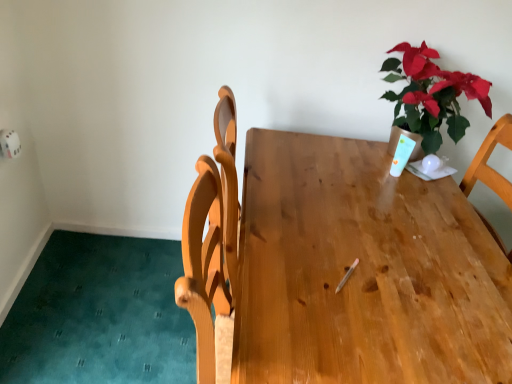
Question: Based on their sizes in the image, would you say wooden table at center is bigger or smaller than green leafy plant at upper right?

Choices:
 (A) big
 (B) small

Answer: (A)

Question: From a real-world perspective, is wooden table at center above or below green leafy plant at upper right?

Choices:
 (A) below
 (B) above

Answer: (A)

Question: Based on their positions, is wooden table at center located to the left or right of green leafy plant at upper right?

Choices:
 (A) right
 (B) left

Answer: (B)

Question: Is green leafy plant at upper right in front of or behind wooden table at center in the image?

Choices:
 (A) behind
 (B) front

Answer: (A)

Question: From a real-world perspective, is green leafy plant at upper right above or below wooden table at center?

Choices:
 (A) below
 (B) above

Answer: (B)

Question: Based on their sizes in the image, would you say green leafy plant at upper right is bigger or smaller than wooden table at center?

Choices:
 (A) small
 (B) big

Answer: (A)

Question: From the image's perspective, is green leafy plant at upper right located above or below wooden table at center?

Choices:
 (A) above
 (B) below

Answer: (A)